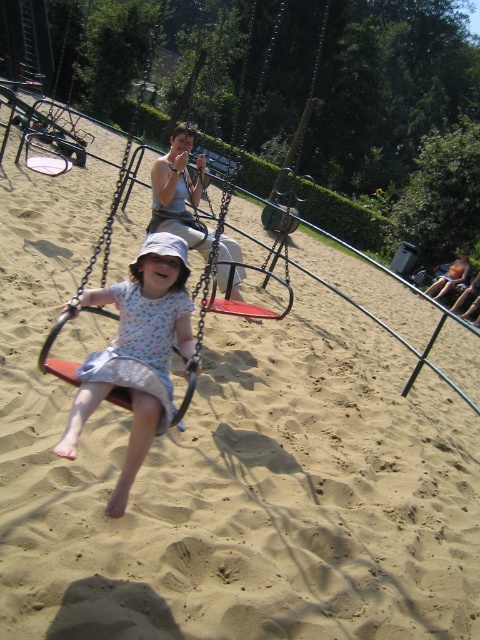
You are a photographer trying to capture the girl in the floral cotton dress at center and the woman in the floral fabric dress at center. Which dress is positioned closer to the camera?

The floral cotton dress at center is closer to the viewer than the floral fabric dress at center, so the photographer should focus on the floral cotton dress at center for a clearer shot.

In the scene shown: You are a photographer trying to capture the perfect shot of the young girl on the red swing seat. To ensure the floral cotton dress at center is visible, where should you position your camera relative to the point marked as point [136,353]?

The floral cotton dress at center is represented by point [136,353], so you should position your camera directly facing this point to ensure the dress is clearly visible in the frame.